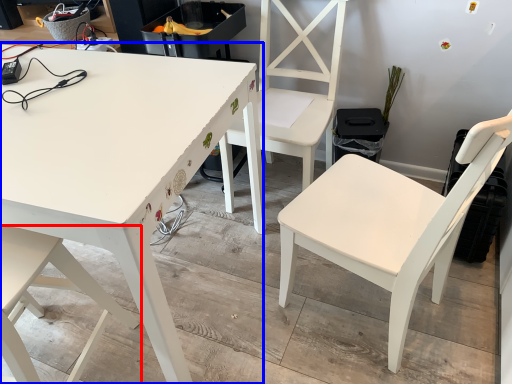
Question: Which of the following is the closest to the observer, chair (highlighted by a red box) or table (highlighted by a blue box)?

Choices:
 (A) chair
 (B) table

Answer: (A)